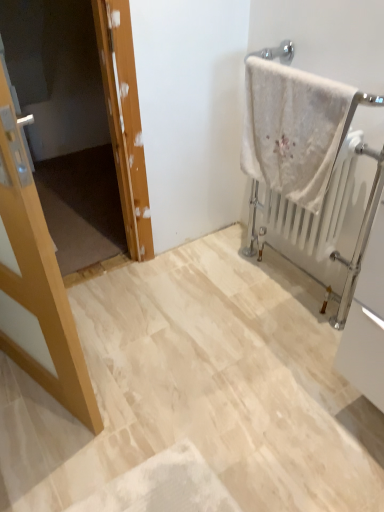
Question: Looking at their shapes, would you say wooden door at left is wider or thinner than light wood door at left?

Choices:
 (A) thin
 (B) wide

Answer: (B)

Question: In terms of height, does wooden door at left look taller or shorter compared to light wood door at left?

Choices:
 (A) tall
 (B) short

Answer: (B)

Question: Considering the real-world distances, which object is farthest from the white metallic radiator at right?

Choices:
 (A) wooden door at left
 (B) white fluffy towel at upper right
 (C) light wood door at left

Answer: (A)

Question: Which object is positioned closest to the light wood door at left?

Choices:
 (A) white metallic radiator at right
 (B) wooden door at left
 (C) white fluffy towel at upper right

Answer: (C)